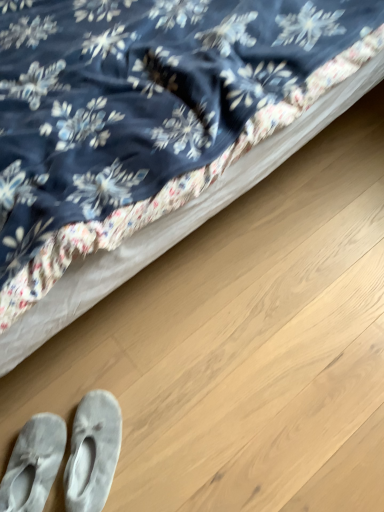
Find the location of a particular element. The width and height of the screenshot is (384, 512). unoccupied space behind light gray suede slippers at lower left, which is the 1th footwear in right-to-left order is located at coordinates (92, 372).